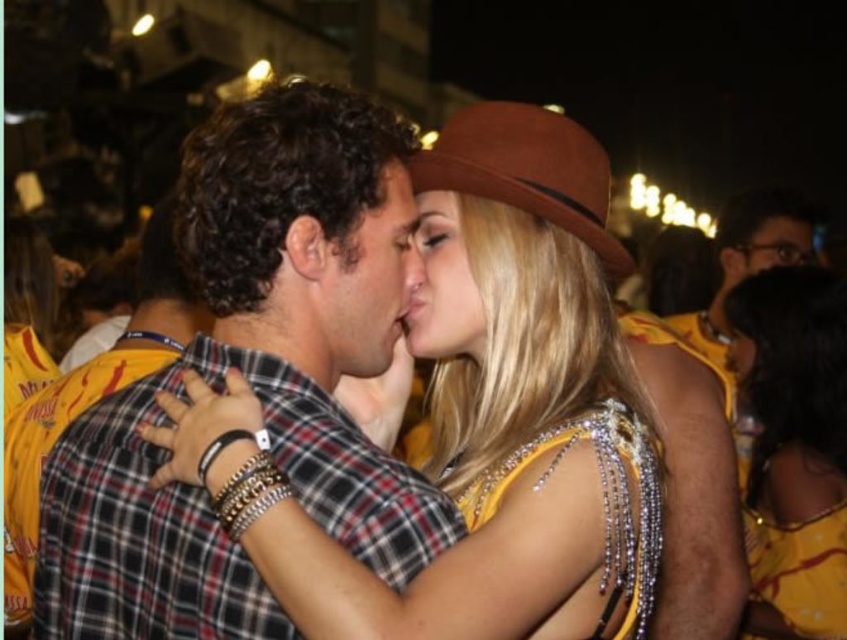
You are a photographer at the event and need to capture a group photo of the shiny gold dress at center and the yellow sequined dress at center. If the camera frame can only accommodate a total width of 1.5 meters, will both dresses fit side by side?

The shiny gold dress at center is wider than the yellow sequined dress at center. The total width of both dresses combined may exceed the camera frame limit of 1.5 meters. To ensure both fit, adjust their positions or use a wider frame.

You are standing at the origin point in the image. Which of the two points, point (x=580, y=211) or point (x=382, y=292), is closer to you?

Point (x=580, y=211) is in front of point (x=382, y=292), so it is closer to you.

Consider the image. You are at a nighttime event and want to locate two hats in the scene. The first is the brown felt cowboy hat at upper center and the second is the matte brown hat at center. Which one is positioned to the right of the other?

The brown felt cowboy hat at upper center is to the right of the matte brown hat at center.